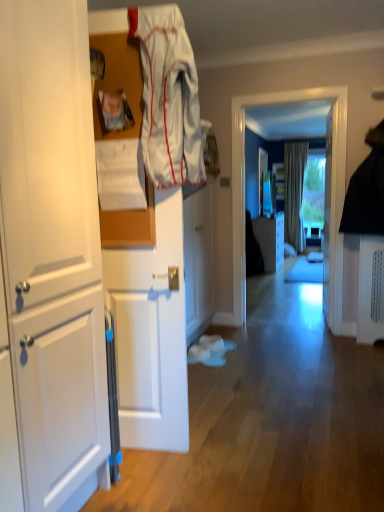
Question: Visually, is transparent glass window at center positioned to the left or to the right of white fabric at upper center?

Choices:
 (A) right
 (B) left

Answer: (A)

Question: Is transparent glass window at center taller or shorter than white fabric at upper center?

Choices:
 (A) short
 (B) tall

Answer: (B)

Question: Considering the real-world distances, which object is farthest from the white matte cabinet at left, placed as the 1th cabinetry when sorted from front to back?

Choices:
 (A) matte white cabinet at center, which ranks as the 3th cabinetry in left-to-right order
 (B) beige textured curtain at center
 (C) transparent glass window at center
 (D) white fabric at upper center
 (E) matte plastic photo frame at upper left

Answer: (B)

Question: Which object is the farthest from the white paper at upper center?

Choices:
 (A) white matte cabinet at center, the 2th cabinetry when ordered from back to front
 (B) white glossy door at center
 (C) transparent glass window at center
 (D) matte white cabinet at center, which ranks as the 3th cabinetry in left-to-right order
 (E) beige textured curtain at center

Answer: (E)